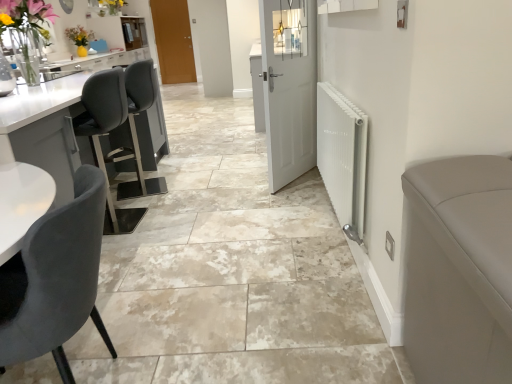
Question: Is white matte door at center, which is counted as the second door, starting from the top, taller than white glossy sink at upper left?

Choices:
 (A) yes
 (B) no

Answer: (A)

Question: From the image's perspective, is white matte door at center, which is counted as the second door, starting from the top, under white glossy sink at upper left?

Choices:
 (A) yes
 (B) no

Answer: (A)

Question: Can you confirm if white matte door at center, positioned as the second door in left-to-right order, is shorter than white glossy sink at upper left?

Choices:
 (A) yes
 (B) no

Answer: (B)

Question: Is white matte door at center, the 1th door viewed from the front, placed right next to white glossy sink at upper left?

Choices:
 (A) yes
 (B) no

Answer: (B)

Question: Is white matte door at center, the 1th door from the bottom, located outside white glossy sink at upper left?

Choices:
 (A) no
 (B) yes

Answer: (B)

Question: Looking at their shapes, would you say velvet grey chair at lower left is wider or thinner than white glossy sink at upper left?

Choices:
 (A) thin
 (B) wide

Answer: (B)

Question: Would you say velvet grey chair at lower left is inside or outside white glossy sink at upper left?

Choices:
 (A) inside
 (B) outside

Answer: (B)

Question: Considering the positions of point (84, 236) and point (58, 67), is point (84, 236) closer or farther from the camera than point (58, 67)?

Choices:
 (A) closer
 (B) farther

Answer: (A)

Question: From a real-world perspective, is velvet grey chair at lower left physically located above or below white glossy sink at upper left?

Choices:
 (A) above
 (B) below

Answer: (B)

Question: Considering the positions of white metallic radiator at right and velvet grey chair at lower left in the image, is white metallic radiator at right bigger or smaller than velvet grey chair at lower left?

Choices:
 (A) big
 (B) small

Answer: (B)

Question: From a real-world perspective, is white metallic radiator at right positioned above or below velvet grey chair at lower left?

Choices:
 (A) above
 (B) below

Answer: (A)

Question: Is white metallic radiator at right taller or shorter than velvet grey chair at lower left?

Choices:
 (A) short
 (B) tall

Answer: (A)

Question: From the image's perspective, is white metallic radiator at right above or below velvet grey chair at lower left?

Choices:
 (A) above
 (B) below

Answer: (A)

Question: From the image's perspective, is white glossy sink at upper left positioned above or below brown wooden door at upper center, positioned as the 2th door in right-to-left order?

Choices:
 (A) above
 (B) below

Answer: (B)

Question: In the image, is white glossy sink at upper left positioned in front of or behind brown wooden door at upper center, which is the 1th door from top to bottom?

Choices:
 (A) behind
 (B) front

Answer: (B)